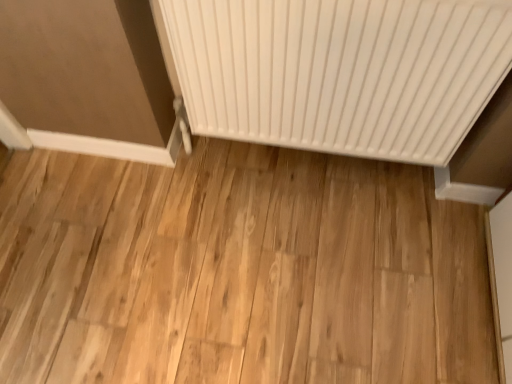
In order to click on free space to the left of white ribbed radiator at center in this screenshot , I will do `click(164, 216)`.